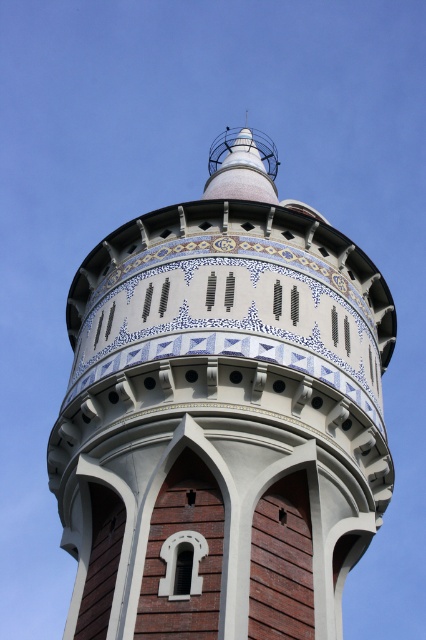
From the picture: You are an architect examining the water tower. You notice the white ceramic tower at center and the white glossy spire at upper center. Which of these two elements is positioned closer to your viewpoint?

The white ceramic tower at center is closer to the viewer than the white glossy spire at upper center.

You are standing at the base of the water tower and want to take a photo of the point at coordinates point [342,582]. If your camera has a maximum zoom range of 35 meters, will you be able to capture that point clearly in your photo?

The point [342,582] is 40.61 meters away from the camera. Since the camera can only zoom up to 35 meters, you won

You are an architect examining the water tower. You notice the white ceramic tower at center and the white glossy spire at upper center. Which one is located to the left of the other?

The white ceramic tower at center is positioned on the left side of white glossy spire at upper center.